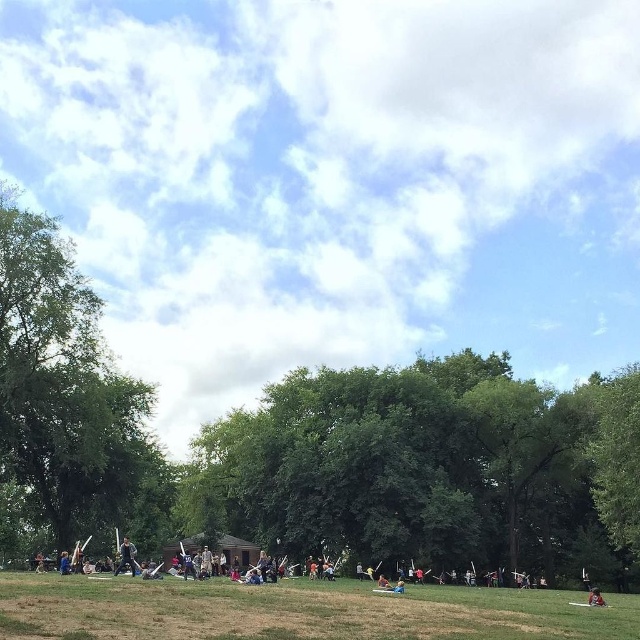
Consider the image. You are standing at the point with coordinates point (592, 588) and want to walk to the point (44, 291). Which direction should you move?

You should move forward because point (44, 291) is in front of point (592, 588).

You are a photographer trying to capture a clear shot of the dark gray fabric person at center. However, the red fabric person at lower right is blocking your view. Can you move around to the left side to get an unobstructed view?

The red fabric person at lower right is behind the dark gray fabric person at center, so moving to the left side would still allow you to see the dark gray fabric person at center without obstruction from the red fabric person at lower right.

You are a photographer trying to capture both the dark gray fabric person at center and the red fabric person at lower right in a single shot. Based on their positions, which one would appear closer to the camera in the photo?

The dark gray fabric person at center appears closer to the camera because they are positioned above the red fabric person at lower right, indicating they are nearer in the scene.